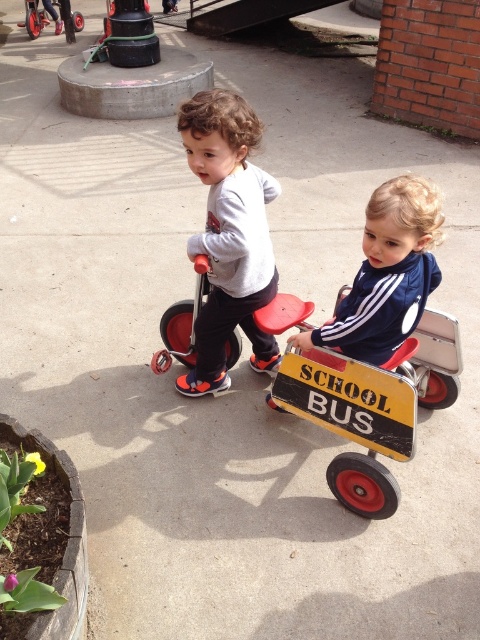
Who is more distant from viewer, (216, 212) or (436, 234)?

Positioned behind is point (216, 212).

Does gray matte shirt at center have a lesser width compared to blue smooth jacket at center?

Indeed, gray matte shirt at center has a lesser width compared to blue smooth jacket at center.

Does point (235, 220) lie behind point (404, 328)?

Yes, point (235, 220) is farther from viewer.

Identify the location of gray matte shirt at center. Image resolution: width=480 pixels, height=640 pixels. (228, 234).